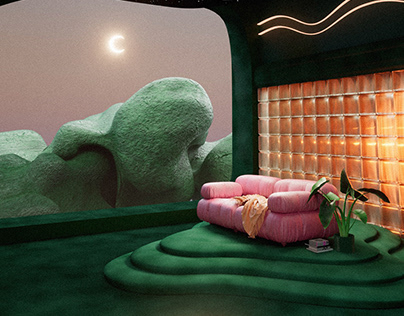
Image resolution: width=404 pixels, height=316 pixels. I want to click on plant, so click(x=347, y=225).